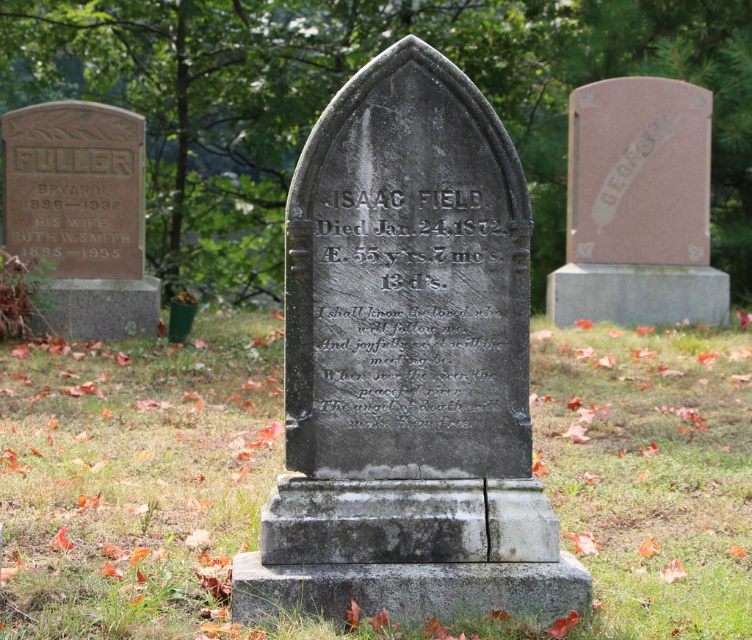
In the scene shown: You are a gardener tasked with maintaining the cemetery. You notice the green grass at center and the gray stone gravestone at center. Which object has a smaller width?

The green grass at center is thinner than the gray stone gravestone at center, so the green grass at center has a smaller width.